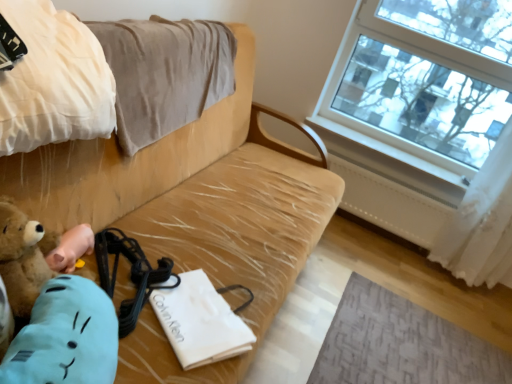
Question: Is point (55, 248) closer or farther from the camera than point (1, 13)?

Choices:
 (A) closer
 (B) farther

Answer: (B)

Question: Considering their positions, is brown plush toy at lower left located in front of or behind beige cotton blanket at upper left, the second blanket when ordered from back to front?

Choices:
 (A) front
 (B) behind

Answer: (B)

Question: Which of these objects is positioned farthest from the white sheer curtain at right?

Choices:
 (A) textured gray mat at lower right
 (B) beige fabric couch at center
 (C) beige cotton blanket at upper left, placed as the first blanket when sorted from front to back
 (D) beige cotton blanket at upper left, the first blanket in the back-to-front sequence
 (E) brown plush toy at lower left

Answer: (C)

Question: Which object is the closest to the white sheer curtain at right?

Choices:
 (A) beige cotton blanket at upper left, the 2th blanket when ordered from front to back
 (B) textured gray mat at lower right
 (C) brown plush toy at lower left
 (D) white paper bag at center
 (E) white painted wood at upper right

Answer: (E)